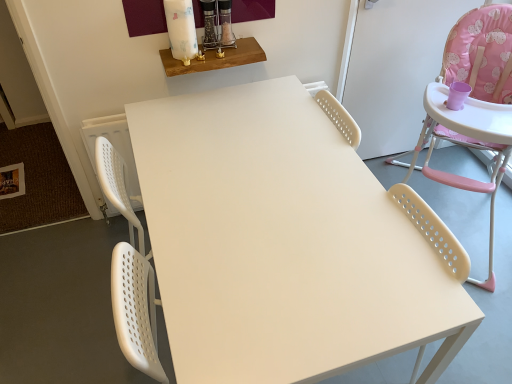
Question: Does wooden shelf at upper center, arranged as the second table when ordered from the bottom, have a lesser width compared to matte white table at center, which is counted as the second table, starting from the left?

Choices:
 (A) no
 (B) yes

Answer: (B)

Question: Considering the relative sizes of wooden shelf at upper center, arranged as the second table when ordered from the bottom, and matte white table at center, which appears as the second table when viewed from the top, in the image provided, is wooden shelf at upper center, arranged as the second table when ordered from the bottom, bigger than matte white table at center, which appears as the second table when viewed from the top,?

Choices:
 (A) no
 (B) yes

Answer: (A)

Question: Is wooden shelf at upper center, arranged as the first table when viewed from the back, located outside matte white table at center, which is counted as the second table, starting from the left?

Choices:
 (A) no
 (B) yes

Answer: (B)

Question: Is the position of wooden shelf at upper center, arranged as the first table when viewed from the back, more distant than that of matte white table at center, which appears as the second table when viewed from the top?

Choices:
 (A) no
 (B) yes

Answer: (B)

Question: From the image's perspective, does wooden shelf at upper center, which is counted as the 1th table, starting from the top, appear lower than matte white table at center, marked as the first table in a right-to-left arrangement?

Choices:
 (A) no
 (B) yes

Answer: (A)

Question: Is wooden shelf at upper center, which is counted as the 1th table, starting from the top, at the left side of matte white table at center, which ranks as the first table in front-to-back order?

Choices:
 (A) yes
 (B) no

Answer: (A)

Question: From a real-world perspective, is pink fabric highchair at right positioned over matte white table at center, marked as the first table in a right-to-left arrangement, based on gravity?

Choices:
 (A) no
 (B) yes

Answer: (B)

Question: Can you confirm if pink fabric highchair at right is taller than matte white table at center, which is counted as the 1th table, starting from the bottom?

Choices:
 (A) no
 (B) yes

Answer: (B)

Question: Can you confirm if pink fabric highchair at right is thinner than matte white table at center, which is counted as the second table, starting from the left?

Choices:
 (A) no
 (B) yes

Answer: (B)

Question: Is the position of pink fabric highchair at right more distant than that of matte white table at center, marked as the first table in a right-to-left arrangement?

Choices:
 (A) yes
 (B) no

Answer: (A)

Question: Does pink fabric highchair at right contain matte white table at center, marked as the first table in a right-to-left arrangement?

Choices:
 (A) no
 (B) yes

Answer: (A)

Question: From the image's perspective, does pink fabric highchair at right appear lower than matte white table at center, which is counted as the 1th table, starting from the bottom?

Choices:
 (A) no
 (B) yes

Answer: (A)

Question: Is wooden shelf at upper center, which is the 2th table from right to left, behind pink fabric highchair at right?

Choices:
 (A) no
 (B) yes

Answer: (B)